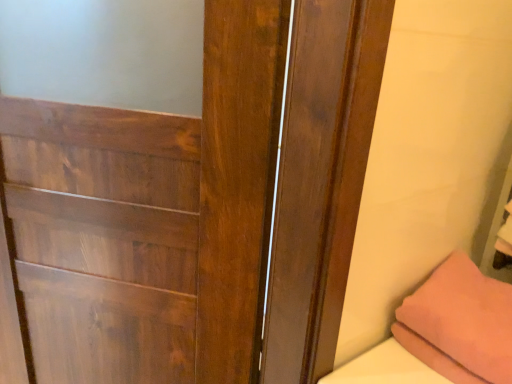
The height and width of the screenshot is (384, 512). Describe the element at coordinates (459, 323) in the screenshot. I see `pink fabric pillow at lower right` at that location.

You are a GUI agent. You are given a task and a screenshot of the screen. Output one action in this format:
    pyautogui.click(x=<x>, y=<y>)
    Task: Click on the pink fabric pillow at lower right
    
    Given the screenshot: What is the action you would take?
    pyautogui.click(x=459, y=323)

At what (x,y) coordinates should I click in order to perform the action: click on pink fabric pillow at lower right. Please return your answer as a coordinate pair (x, y). This screenshot has width=512, height=384. Looking at the image, I should click on pyautogui.click(x=459, y=323).